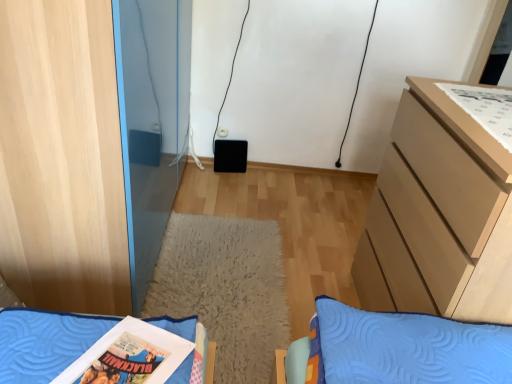
Identify the location of light wood cabinet at left. The height and width of the screenshot is (384, 512). (62, 158).

Measure the distance between light wood cabinet at left and camera.

The depth of light wood cabinet at left is 3.51 feet.

Describe the element at coordinates (45, 342) in the screenshot. This screenshot has width=512, height=384. I see `blue quilted pillow at lower left` at that location.

In order to face white paper comic book at upper right, should I rotate leftwards or rightwards?

Turn right approximately 31.444 degrees to face it.

What do you see at coordinates (485, 108) in the screenshot? This screenshot has width=512, height=384. I see `white paper comic book at upper right` at bounding box center [485, 108].

I want to click on light brown wooden chest of drawers at right, so click(x=438, y=215).

How many degrees apart are the facing directions of light wood cabinet at left and white paper comic book at upper right?

178 degrees.

At what (x,y) coordinates should I click in order to perform the action: click on cabinetry in front of the white paper comic book at upper right. Please return your answer as a coordinate pair (x, y). The width and height of the screenshot is (512, 384). Looking at the image, I should click on (62, 158).

Which object is positioned more to the left, light wood cabinet at left or white paper comic book at upper right?

light wood cabinet at left is more to the left.

Which object is thinner, light wood cabinet at left or white paper comic book at upper right?

With smaller width is white paper comic book at upper right.

From a real-world perspective, who is located higher, light wood cabinet at left or blue quilted pillow at lower left?

light wood cabinet at left.

How far apart are light wood cabinet at left and blue quilted pillow at lower left?

51.63 centimeters.

Which is nearer, [46,245] or [37,377]?

Point [46,245] is positioned farther from the camera compared to point [37,377].

Can you confirm if light wood cabinet at left is smaller than blue quilted pillow at lower left?

No, light wood cabinet at left is not smaller than blue quilted pillow at lower left.

Is white fluffy rug at center far away from light brown wooden chest of drawers at right?

white fluffy rug at center is actually quite close to light brown wooden chest of drawers at right.

Is point (230, 341) closer or farther from the camera than point (380, 269)?

Point (230, 341) is closer to the camera than point (380, 269).

Between white fluffy rug at center and light brown wooden chest of drawers at right, which one has more height?

With more height is light brown wooden chest of drawers at right.

From the image's perspective, is white fluffy rug at center above light brown wooden chest of drawers at right?

No, from the image's perspective, white fluffy rug at center is not above light brown wooden chest of drawers at right.

How many degrees apart are the facing directions of white fluffy rug at center and light wood cabinet at left?

There is a 90.5-degree angle between the facing directions of white fluffy rug at center and light wood cabinet at left.

Does white fluffy rug at center have a smaller size compared to light wood cabinet at left?

Yes.

Does white fluffy rug at center touch light wood cabinet at left?

No, white fluffy rug at center is not next to light wood cabinet at left.

Consider the image. Would you say white fluffy rug at center is outside light wood cabinet at left?

Absolutely, white fluffy rug at center is external to light wood cabinet at left.

Is white fluffy rug at center placed right next to white paper comic book at upper right?

No, white fluffy rug at center is not touching white paper comic book at upper right.

Can you tell me how much white fluffy rug at center and white paper comic book at upper right differ in facing direction?

The facing directions of white fluffy rug at center and white paper comic book at upper right are 87.1 degrees apart.

Considering the relative sizes of white fluffy rug at center and white paper comic book at upper right in the image provided, is white fluffy rug at center thinner than white paper comic book at upper right?

Incorrect, the width of white fluffy rug at center is not less than that of white paper comic book at upper right.

Consider the image. From the image's perspective, would you say white fluffy rug at center is positioned over white paper comic book at upper right?

No, from the image's perspective, white fluffy rug at center is not above white paper comic book at upper right.

Can you confirm if white fluffy rug at center is bigger than blue quilted pillow at lower left?

Correct, white fluffy rug at center is larger in size than blue quilted pillow at lower left.

Considering the relative sizes of white fluffy rug at center and blue quilted pillow at lower left in the image provided, is white fluffy rug at center taller than blue quilted pillow at lower left?

No, white fluffy rug at center is not taller than blue quilted pillow at lower left.

From a real-world perspective, relative to blue quilted pillow at lower left, is white fluffy rug at center vertically above or below?

white fluffy rug at center is situated lower than blue quilted pillow at lower left in the real world.

From the picture: From the image's perspective, which is below, white fluffy rug at center or blue quilted pillow at lower left?

white fluffy rug at center is shown below in the image.

From a real-world perspective, relative to light wood cabinet at left, is white paper comic book at upper right vertically above or below?

Clearly, from a real-world perspective, white paper comic book at upper right is above light wood cabinet at left.

From the image's perspective, is white paper comic book at upper right over light wood cabinet at left?

Actually, white paper comic book at upper right appears below light wood cabinet at left in the image.

Considering the relative sizes of white paper comic book at upper right and light wood cabinet at left in the image provided, is white paper comic book at upper right smaller than light wood cabinet at left?

Yes, white paper comic book at upper right is smaller than light wood cabinet at left.

Which of these two, white paper comic book at upper right or light wood cabinet at left, is wider?

Wider between the two is light wood cabinet at left.

Identify the location of cabinetry above the white paper comic book at upper right (from the image's perspective). This screenshot has height=384, width=512. (62, 158).

Locate an element on the screen. The image size is (512, 384). cabinetry lying behind the blue quilted pillow at lower left is located at coordinates (62, 158).

Estimate the real-world distances between objects in this image. Which object is closer to white fluffy rug at center, light wood cabinet at left or white paper comic book at upper right?

light wood cabinet at left is positioned closer to the anchor white fluffy rug at center.

When comparing their distances from white fluffy rug at center, does white paper comic book at upper right or blue quilted pillow at lower left seem closer?

Based on the image, blue quilted pillow at lower left appears to be nearer to white fluffy rug at center.

From the image, which object appears to be nearer to blue quilted pillow at lower left, white paper comic book at upper right or light brown wooden chest of drawers at right?

light brown wooden chest of drawers at right is closer to blue quilted pillow at lower left.

Looking at the image, which one is located closer to white paper comic book at upper right, light brown wooden chest of drawers at right or light wood cabinet at left?

light brown wooden chest of drawers at right lies closer to white paper comic book at upper right than the other object.

Looking at the image, which one is located further to white paper comic book at upper right, light wood cabinet at left or white fluffy rug at center?

The object further to white paper comic book at upper right is light wood cabinet at left.

Considering their positions, is white paper comic book at upper right positioned closer to white fluffy rug at center than light brown wooden chest of drawers at right?

Among the two, light brown wooden chest of drawers at right is located nearer to white fluffy rug at center.

Considering their positions, is light wood cabinet at left positioned closer to blue quilted pillow at lower left than white paper comic book at upper right?

light wood cabinet at left lies closer to blue quilted pillow at lower left than the other object.

Looking at the image, which one is located closer to white paper comic book at upper right, white fluffy rug at center or blue quilted pillow at lower left?

Among the two, blue quilted pillow at lower left is located nearer to white paper comic book at upper right.

Where is `mat between blue quilted pillow at lower left and light brown wooden chest of drawers at right`? mat between blue quilted pillow at lower left and light brown wooden chest of drawers at right is located at coordinates (225, 289).

Identify the location of the chest of drawers located between light wood cabinet at left and white paper comic book at upper right in the left-right direction. (438, 215).

This screenshot has width=512, height=384. In order to click on the chest of drawers located between white fluffy rug at center and white paper comic book at upper right in the left-right direction in this screenshot , I will do `click(438, 215)`.

At what (x,y) coordinates should I click in order to perform the action: click on mat between light wood cabinet at left and white paper comic book at upper right from left to right. Please return your answer as a coordinate pair (x, y). This screenshot has height=384, width=512. Looking at the image, I should click on (225, 289).